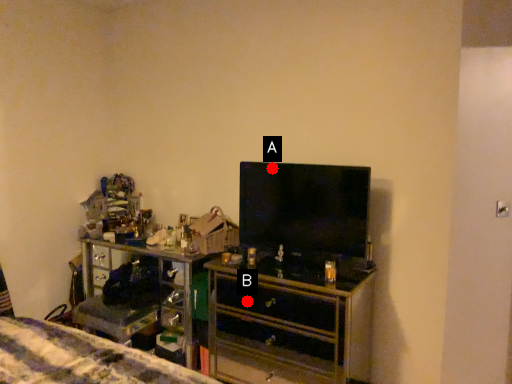
Question: Two points are circled on the image, labeled by A and B beside each circle. Among these points, which one is nearest to the camera?

Choices:
 (A) A is closer
 (B) B is closer

Answer: (A)